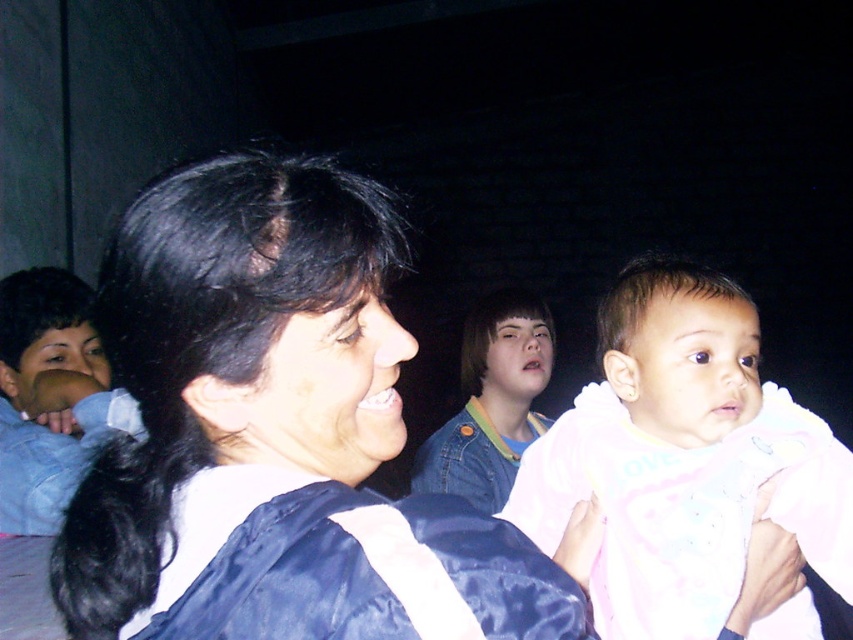
Question: Which of the following is the farthest from the observer?

Choices:
 (A) (436, 449)
 (B) (843, 554)

Answer: (A)

Question: Which object appears closest to the camera in this image?

Choices:
 (A) blue denim jacket at left
 (B) shiny blue jacket at center
 (C) denim jacket at center
 (D) pink soft fabric baby at center

Answer: (B)

Question: Does pink soft fabric baby at center appear on the left side of blue denim jacket at left?

Choices:
 (A) yes
 (B) no

Answer: (B)

Question: In this image, where is pink soft fabric baby at center located relative to blue denim jacket at left?

Choices:
 (A) below
 (B) above

Answer: (A)

Question: Which object is the farthest from the denim jacket at center?

Choices:
 (A) shiny blue jacket at center
 (B) pink soft fabric baby at center

Answer: (A)

Question: Is shiny blue jacket at center positioned before blue denim jacket at left?

Choices:
 (A) no
 (B) yes

Answer: (B)